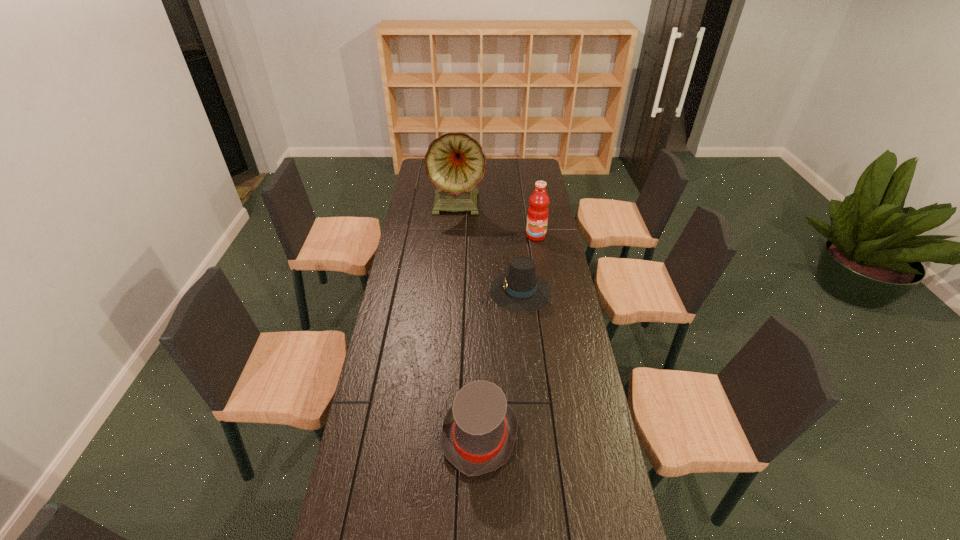
Identify the location of free location located 0.370m on the front-facing side of the farther hat. The image size is (960, 540). (400, 291).

Find the location of a particular element. Image resolution: width=960 pixels, height=540 pixels. free spot located 0.240m on the front-facing side of the farther hat is located at coordinates (432, 291).

The image size is (960, 540). In order to click on object located at the left edge in this screenshot , I will do `click(455, 163)`.

At what (x,y) coordinates should I click in order to perform the action: click on fruit juice that is at the right edge. Please return your answer as a coordinate pair (x, y). Image resolution: width=960 pixels, height=540 pixels. Looking at the image, I should click on (538, 211).

Where is `hat that is at the right edge`? This screenshot has height=540, width=960. hat that is at the right edge is located at coordinates (520, 290).

You are a GUI agent. You are given a task and a screenshot of the screen. Output one action in this format:
    pyautogui.click(x=<x>, y=<y>)
    Task: Click on the vacant position at the left edge of the desktop
    
    Given the screenshot: What is the action you would take?
    pyautogui.click(x=431, y=258)

The height and width of the screenshot is (540, 960). I want to click on vacant area at the right edge, so click(x=557, y=275).

At what (x,y) coordinates should I click in order to perform the action: click on unoccupied area between the farther hat and the record player. Please return your answer as a coordinate pair (x, y). The height and width of the screenshot is (540, 960). Looking at the image, I should click on point(490,248).

Identify the location of empty space between the nearest object and the second nearest object. (500, 363).

Where is `the third closest object to the fruit juice`? the third closest object to the fruit juice is located at coordinates (479, 430).